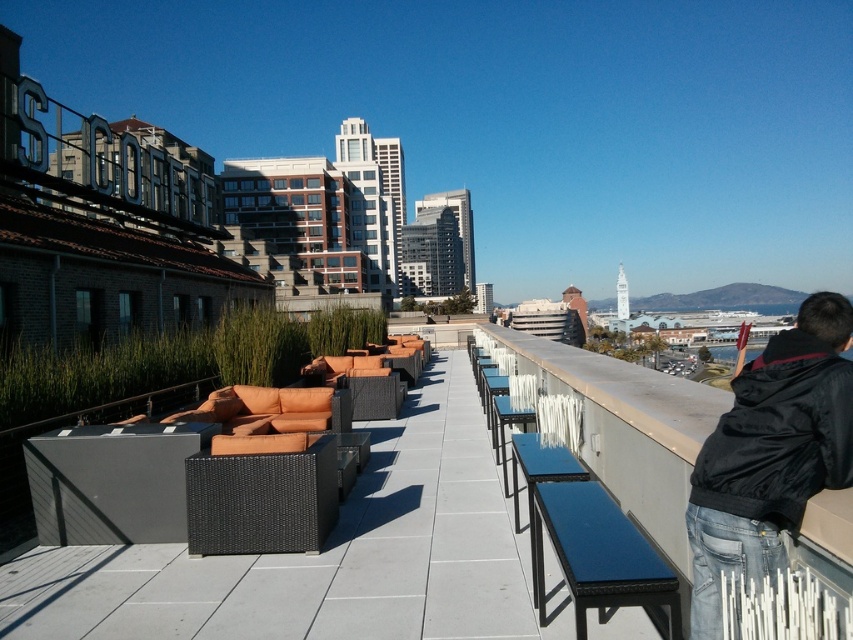
Which is below, black matte jacket at upper right or blue plastic bench at right?

Positioned lower is black matte jacket at upper right.

Can you confirm if black matte jacket at upper right is bigger than blue plastic bench at right?

Yes.

Locate an element on the screen. black matte jacket at upper right is located at coordinates (770, 452).